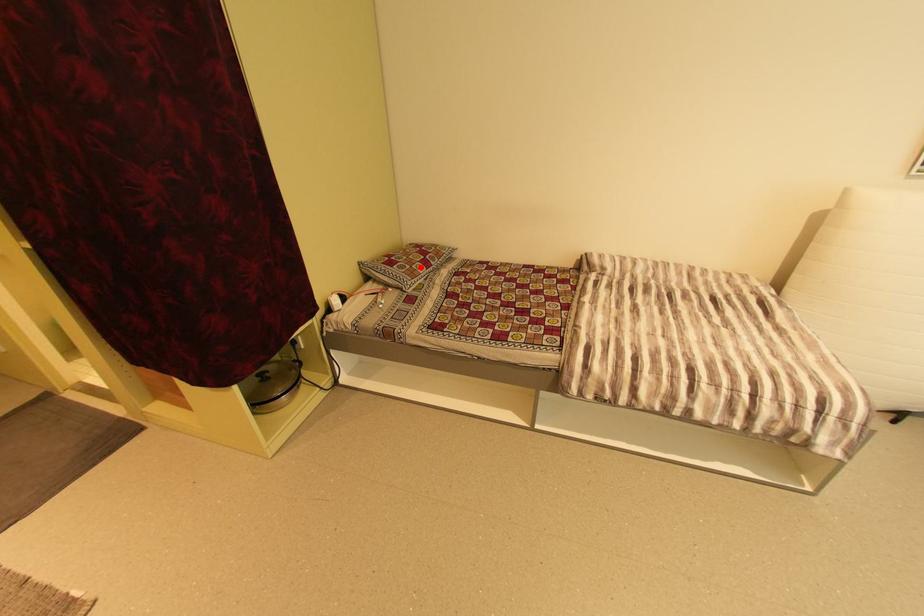
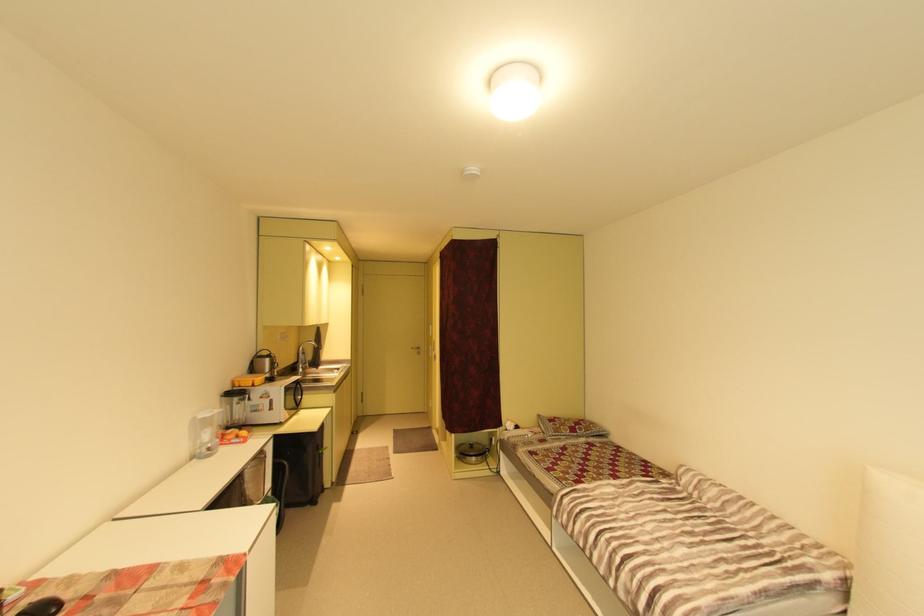
The point at the highlighted location is marked in the first image. Where is the corresponding point in the second image?

(568, 428)